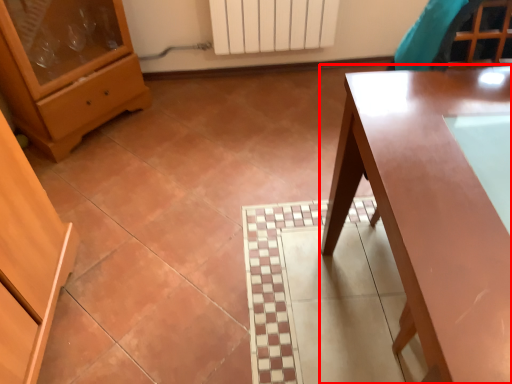
Question: Observing the image, what is the correct spatial positioning of table (annotated by the red box) in reference to chest of drawers?

Choices:
 (A) left
 (B) right

Answer: (B)